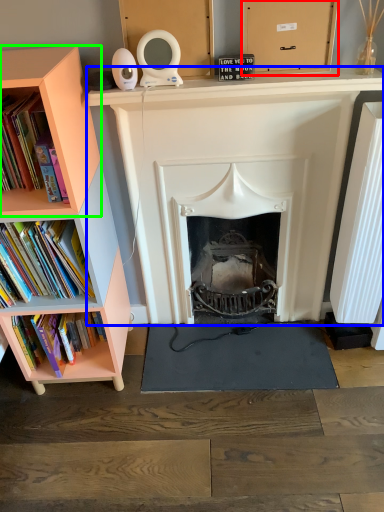
Question: Estimate the real-world distances between objects in this image. Which object is closer to cardboard box (highlighted by a red box), fireplace (highlighted by a blue box) or shelf (highlighted by a green box)?

Choices:
 (A) fireplace
 (B) shelf

Answer: (A)